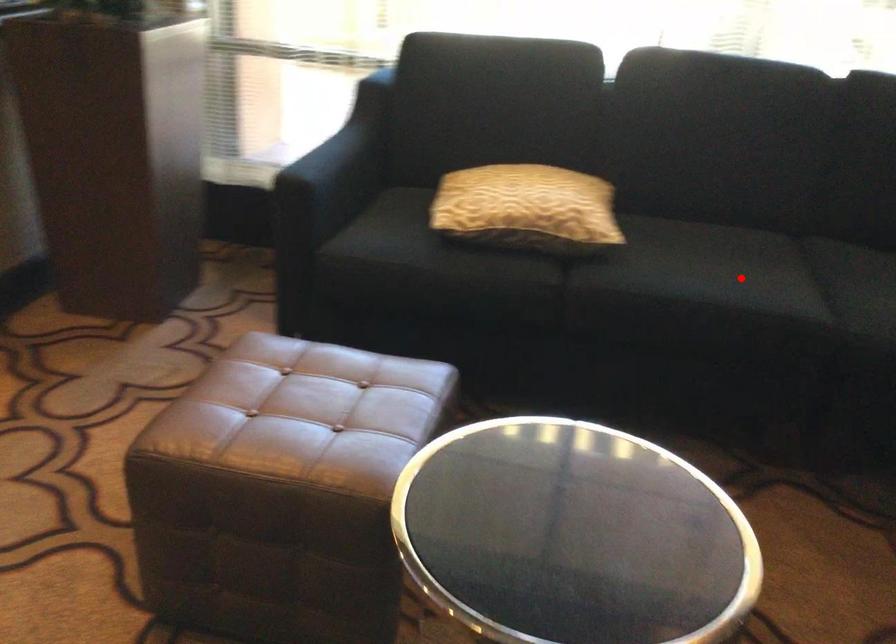
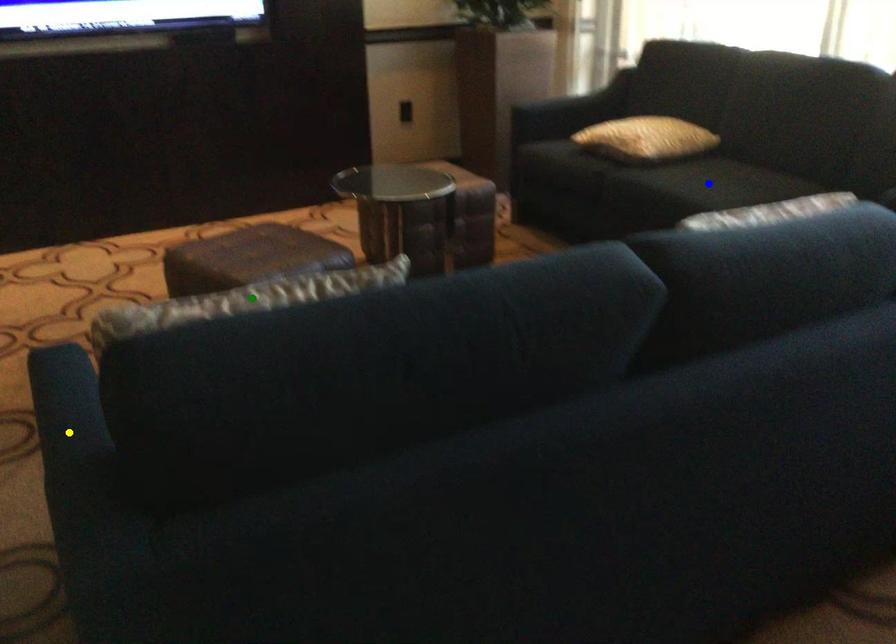
Question: I am providing you with two images of the same scene from different viewpoints. A red point is marked on the first image. You are given multiple points on the second image. Which point in image 2 represents the same 3d spot as the red point in image 1?

Choices:
 (A) yellow point
 (B) blue point
 (C) green point

Answer: (B)